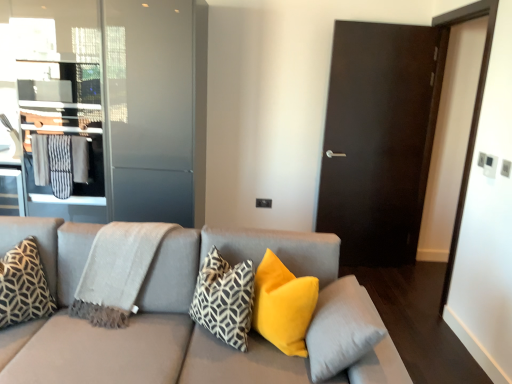
Question: In the image, is soft yellow pillow at center, which appears as the first pillow when viewed from the right, on the left side or the right side of matte gray couch at center?

Choices:
 (A) left
 (B) right

Answer: (B)

Question: Does point (355, 281) appear closer or farther from the camera than point (60, 314)?

Choices:
 (A) closer
 (B) farther

Answer: (B)

Question: Considering the real-world distances, which object is farthest from the velvet yellow pillow at center, placed as the third pillow when sorted from left to right?

Choices:
 (A) geometric-patterned fabric pillow at center, the 3th pillow in the right-to-left sequence
 (B) geometric-patterned fabric pillow at left, which is the fourth pillow in right-to-left order
 (C) soft yellow pillow at center, which ranks as the 4th pillow in left-to-right order
 (D) light gray woven blanket at left
 (E) transparent glass screen door at upper left

Answer: (E)

Question: Based on their relative distances, which object is farther from the soft yellow pillow at center, which ranks as the 4th pillow in left-to-right order?

Choices:
 (A) geometric-patterned fabric pillow at center, the 2th pillow when ordered from left to right
 (B) light gray woven blanket at left
 (C) matte gray couch at center
 (D) metallic glass elevator at left
 (E) geometric-patterned fabric pillow at left, which is the fourth pillow in right-to-left order

Answer: (D)